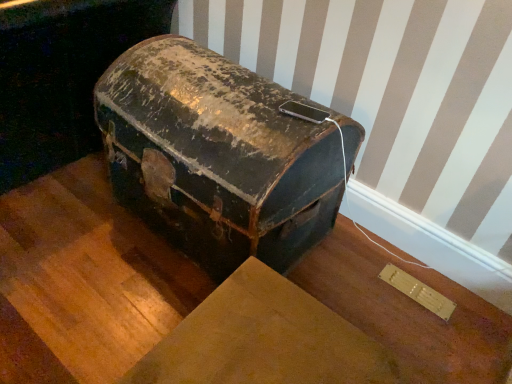
Question: From the image's perspective, is rusty metal trunk at center located above or below rusty leather suitcase at center?

Choices:
 (A) above
 (B) below

Answer: (A)

Question: Would you say rusty metal trunk at center is to the left or to the right of rusty leather suitcase at center in the picture?

Choices:
 (A) right
 (B) left

Answer: (B)

Question: Is rusty metal trunk at center spatially inside rusty leather suitcase at center, or outside of it?

Choices:
 (A) outside
 (B) inside

Answer: (A)

Question: Based on their positions, is rusty leather suitcase at center located to the left or right of rusty metal trunk at center?

Choices:
 (A) right
 (B) left

Answer: (A)

Question: Looking at their shapes, would you say rusty leather suitcase at center is wider or thinner than rusty metal trunk at center?

Choices:
 (A) wide
 (B) thin

Answer: (B)

Question: Considering the positions of point (286, 150) and point (69, 155), is point (286, 150) closer or farther from the camera than point (69, 155)?

Choices:
 (A) closer
 (B) farther

Answer: (A)

Question: Choose the correct answer: Is rusty leather suitcase at center inside rusty metal trunk at center or outside it?

Choices:
 (A) inside
 (B) outside

Answer: (B)